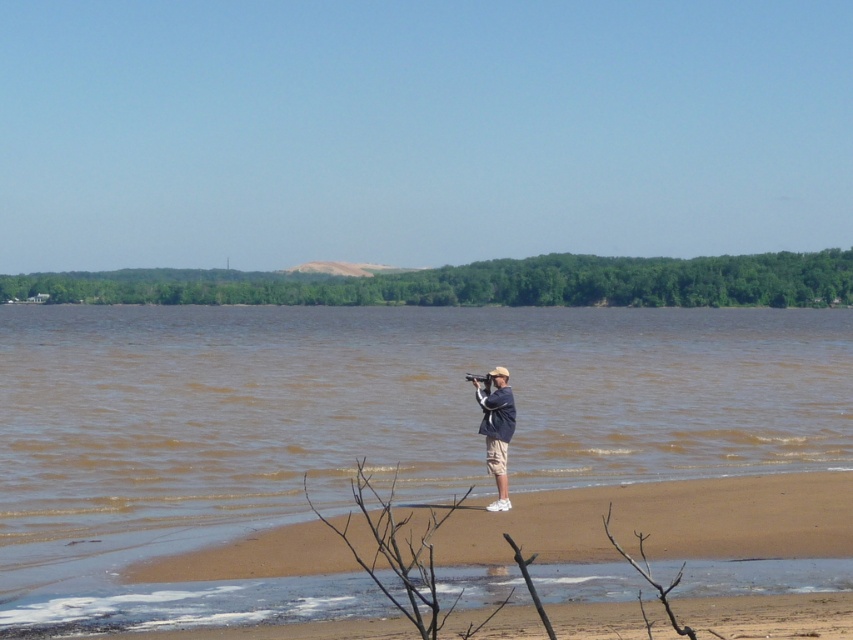
Question: Can you confirm if brown sandy beach at lower center is positioned to the right of light blue denim shirt at center?

Choices:
 (A) yes
 (B) no

Answer: (A)

Question: Which of the following is the farthest from the observer?

Choices:
 (A) light blue denim shirt at center
 (B) brown sandy beach at lower center

Answer: (A)

Question: Is brown sandy beach at lower center thinner than light blue denim shirt at center?

Choices:
 (A) yes
 (B) no

Answer: (B)

Question: Which object appears farthest from the camera in this image?

Choices:
 (A) brown sandy beach at lower center
 (B) light blue denim shirt at center

Answer: (B)

Question: Which object is closer to the camera taking this photo?

Choices:
 (A) light blue denim shirt at center
 (B) brown sandy beach at lower center

Answer: (B)

Question: Can you confirm if brown sandy beach at lower center is positioned below light blue denim shirt at center?

Choices:
 (A) yes
 (B) no

Answer: (A)